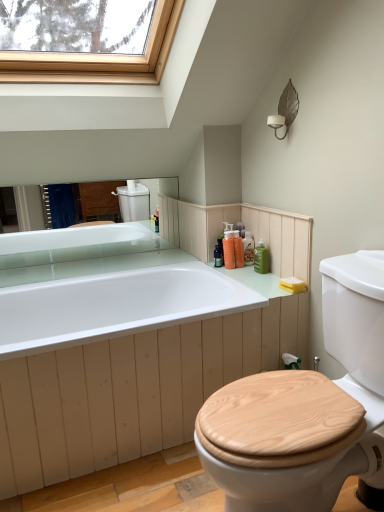
Question: From a real-world perspective, is translucent orange soap at upper right, positioned as the 2th toiletry in left-to-right order, located higher than orange plastic bottle at upper right, marked as the third toiletry in a left-to-right arrangement?

Choices:
 (A) no
 (B) yes

Answer: (B)

Question: Is translucent orange soap at upper right, which is counted as the 3th toiletry, starting from the right, facing away from orange plastic bottle at upper right, marked as the third toiletry in a left-to-right arrangement?

Choices:
 (A) no
 (B) yes

Answer: (B)

Question: Is translucent orange soap at upper right, which is counted as the 3th toiletry, starting from the right, bigger than orange plastic bottle at upper right, marked as the third toiletry in a left-to-right arrangement?

Choices:
 (A) yes
 (B) no

Answer: (A)

Question: From the image's perspective, is translucent orange soap at upper right, which is counted as the 3th toiletry, starting from the right, located beneath orange plastic bottle at upper right, marked as the third toiletry in a left-to-right arrangement?

Choices:
 (A) yes
 (B) no

Answer: (A)

Question: Is translucent orange soap at upper right, positioned as the 2th toiletry in left-to-right order, not close to orange plastic bottle at upper right, which appears as the second toiletry when viewed from the right?

Choices:
 (A) yes
 (B) no

Answer: (B)

Question: Can you confirm if translucent orange soap at upper right, positioned as the 2th toiletry in left-to-right order, is wider than orange plastic bottle at upper right, which appears as the second toiletry when viewed from the right?

Choices:
 (A) yes
 (B) no

Answer: (A)

Question: Can you confirm if orange plastic bottle at upper right, marked as the third toiletry in a left-to-right arrangement, is shorter than translucent plastic bottles at upper right, marked as the 4th toiletry in a right-to-left arrangement?

Choices:
 (A) no
 (B) yes

Answer: (A)

Question: Is orange plastic bottle at upper right, marked as the third toiletry in a left-to-right arrangement, placed right next to translucent plastic bottles at upper right, the first toiletry from the left?

Choices:
 (A) no
 (B) yes

Answer: (A)

Question: From the image's perspective, is orange plastic bottle at upper right, marked as the third toiletry in a left-to-right arrangement, located beneath translucent plastic bottles at upper right, the first toiletry from the left?

Choices:
 (A) no
 (B) yes

Answer: (A)

Question: Is orange plastic bottle at upper right, marked as the third toiletry in a left-to-right arrangement, to the right of translucent plastic bottles at upper right, marked as the 4th toiletry in a right-to-left arrangement, from the viewer's perspective?

Choices:
 (A) yes
 (B) no

Answer: (A)

Question: Is orange plastic bottle at upper right, marked as the third toiletry in a left-to-right arrangement, outside of translucent plastic bottles at upper right, marked as the 4th toiletry in a right-to-left arrangement?

Choices:
 (A) no
 (B) yes

Answer: (B)

Question: From the image's perspective, would you say orange plastic bottle at upper right, which appears as the second toiletry when viewed from the right, is positioned over translucent plastic bottles at upper right, marked as the 4th toiletry in a right-to-left arrangement?

Choices:
 (A) yes
 (B) no

Answer: (A)

Question: Is orange plastic bottle at upper right, marked as the third toiletry in a left-to-right arrangement, facing away from translucent orange soap at upper right, which is counted as the 3th toiletry, starting from the right?

Choices:
 (A) no
 (B) yes

Answer: (B)